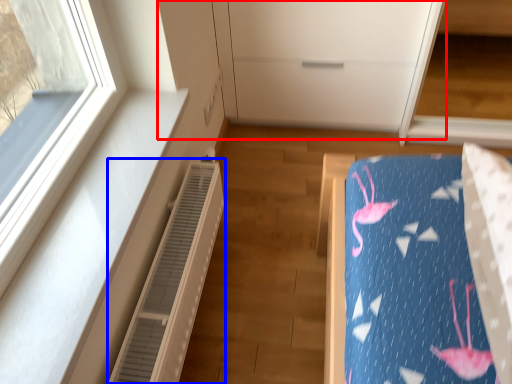
Question: Which object is closer to the camera taking this photo, dresser (highlighted by a red box) or air conditioner (highlighted by a blue box)?

Choices:
 (A) dresser
 (B) air conditioner

Answer: (B)